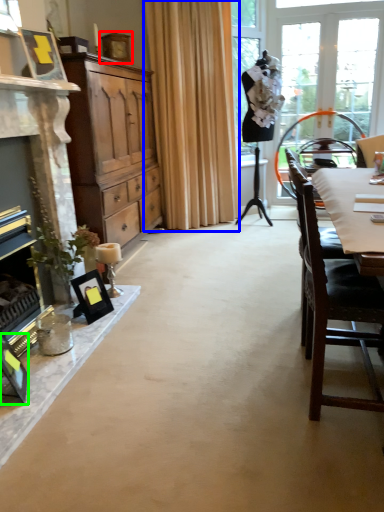
Question: Which object is the farthest from picture frame (highlighted by a red box)? Choose among these: curtain (highlighted by a blue box) or picture frame (highlighted by a green box).

Choices:
 (A) curtain
 (B) picture frame

Answer: (B)